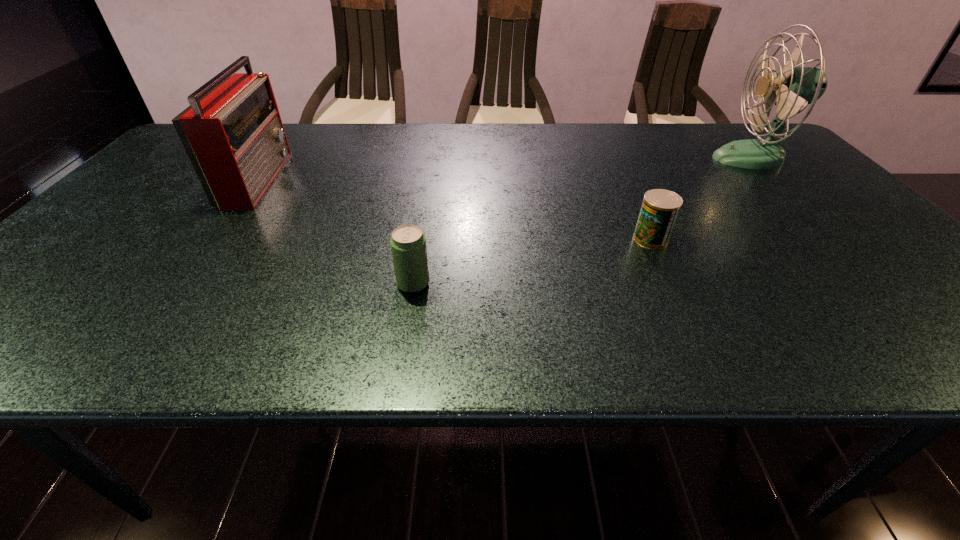
What are the coordinates of `fan` in the screenshot? It's located at (793, 88).

Where is `the tallest object`? This screenshot has height=540, width=960. the tallest object is located at coordinates (793, 88).

This screenshot has height=540, width=960. I want to click on the leftmost object, so click(x=232, y=132).

Locate an element on the screen. the second tallest object is located at coordinates (232, 132).

This screenshot has width=960, height=540. What are the coordinates of `soda` in the screenshot? It's located at (408, 244).

I want to click on the nearest object, so click(x=408, y=244).

At what (x,y) coordinates should I click in order to perform the action: click on the shortest object. Please return your answer as a coordinate pair (x, y). This screenshot has height=540, width=960. Looking at the image, I should click on (660, 208).

This screenshot has height=540, width=960. Identify the location of the second object from right to left. (660, 208).

I want to click on vacant space located in front of the rightmost object, directing airflow, so click(x=602, y=158).

Locate an element on the screen. free space located 0.380m in front of the rightmost object, directing airflow is located at coordinates (586, 158).